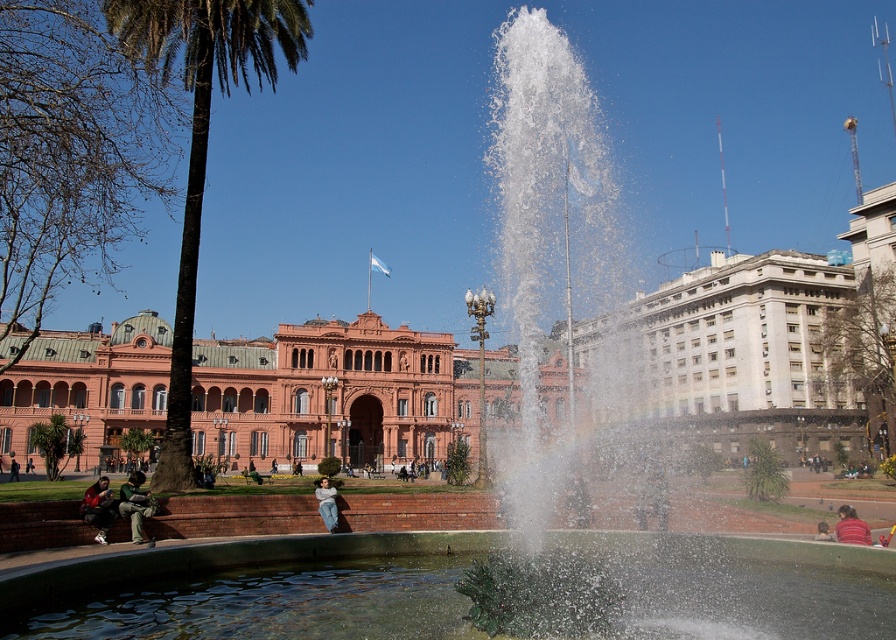
In the scene shown: You are a tourist standing in the public square and you see the green leafy palm tree at left and the green fabric jacket at lower left. Which object is located to the right of the other?

The green leafy palm tree at left is positioned on the right side of green fabric jacket at lower left, so the palm tree is to the right of the jacket.

You are standing in the public square and want to take a photo of both points, point (108,508) and point (317,499). Which point should you focus on first to ensure both are in the frame?

You should focus on point (108,508) first because it is closer to you than point (317,499), ensuring both points are within the camera frame.

You are a fashion designer observing the urban scene. You notice a leather jacket at lower left and denim jeans at lower center. Which item of clothing is wider in terms of their width?

The leather jacket at lower left is wider than the denim jeans at lower center.